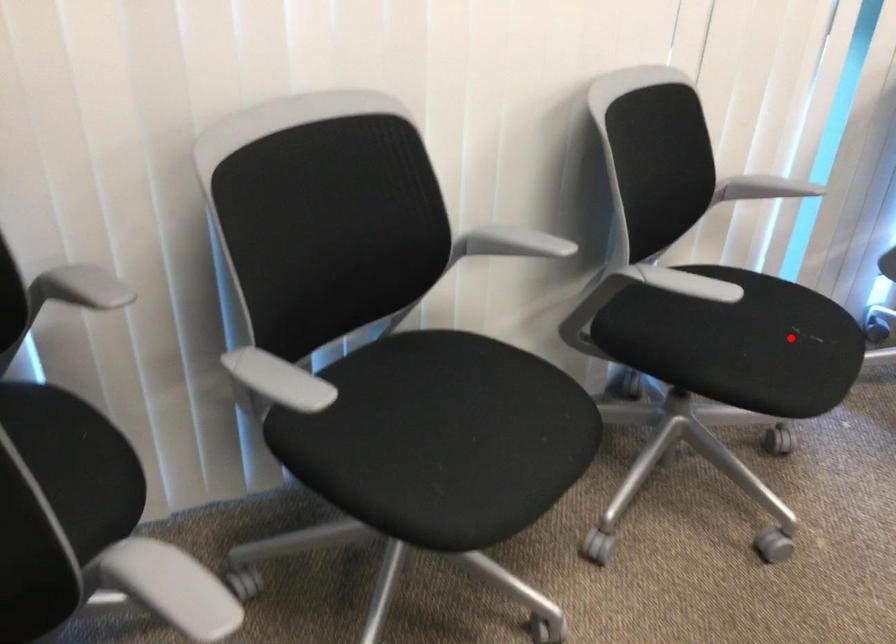
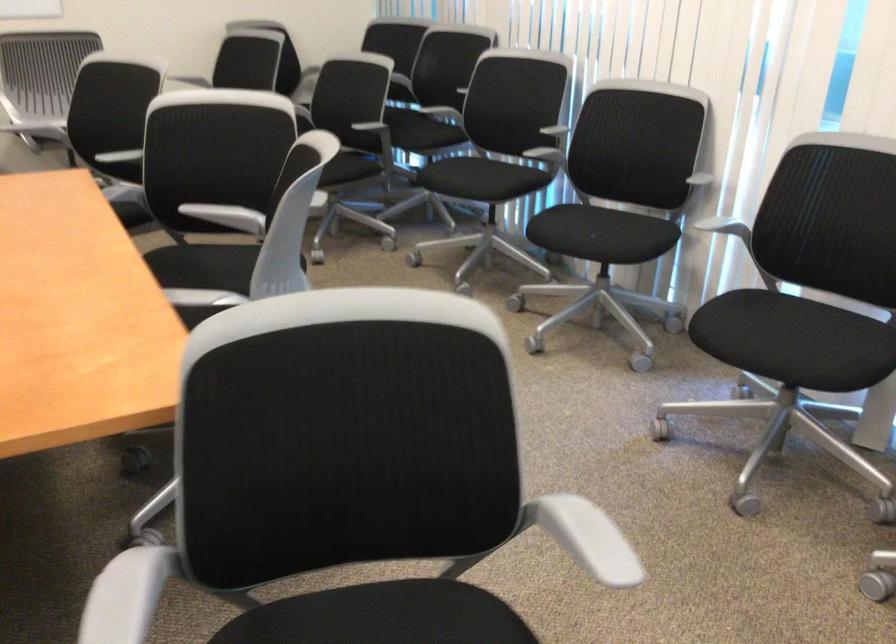
Question: I am providing you with two images of the same scene from different viewpoints. In image1, a red point is highlighted. Considering the same 3D point in image2, which of the following is correct?

Choices:
 (A) It is closer
 (B) It is farther

Answer: (B)